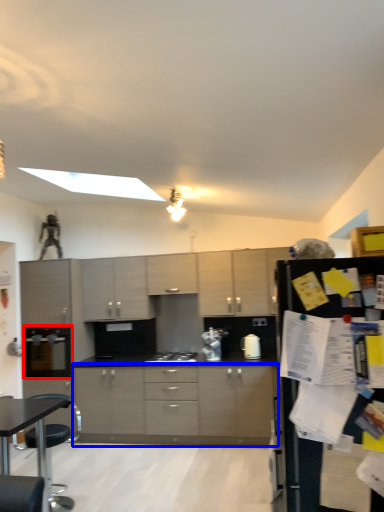
Question: Which point is further to the camera, appliance (highlighted by a red box) or cabinetry (highlighted by a blue box)?

Choices:
 (A) appliance
 (B) cabinetry

Answer: (A)